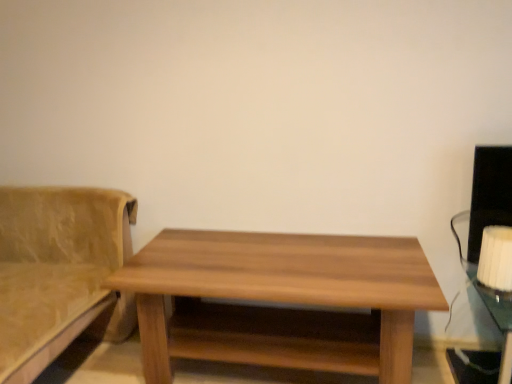
Image resolution: width=512 pixels, height=384 pixels. In order to click on vacant space situated above wooden table at center (from a real-world perspective) in this screenshot , I will do `click(278, 260)`.